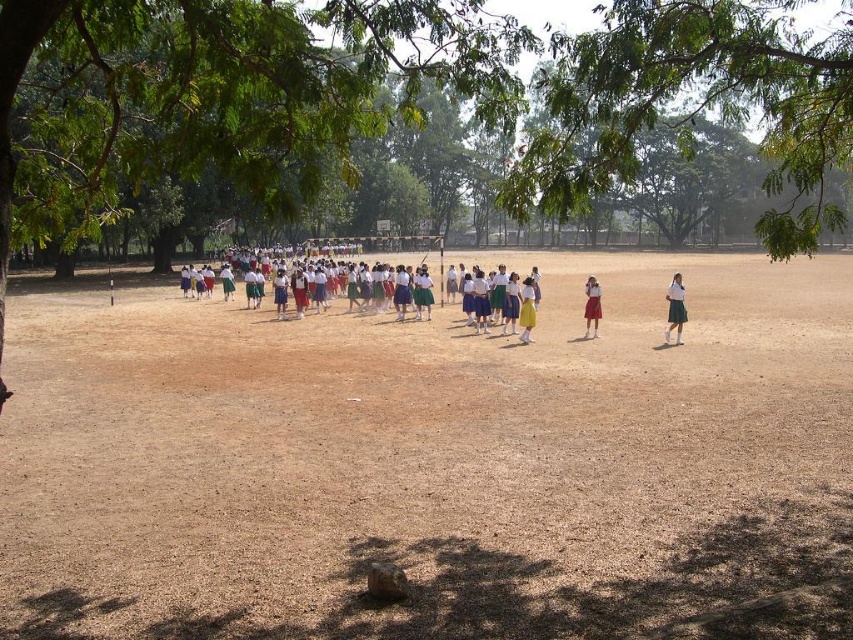
From the picture: Who is higher up, matte white blouse at center or matte red skirt at center?

matte white blouse at center

Measure the distance between point (677, 280) and camera.

A distance of 20.59 meters exists between point (677, 280) and camera.

Find the location of `matte white blouse at center`. matte white blouse at center is located at coordinates (675, 308).

Does point (827, 97) lie in front of point (672, 316)?

Yes, point (827, 97) is closer to viewer.

Can you confirm if green leafy tree at upper center is positioned to the left of matte white blouse at center?

In fact, green leafy tree at upper center is to the right of matte white blouse at center.

Find the location of a particular element. This screenshot has height=640, width=853. green leafy tree at upper center is located at coordinates (695, 104).

Is green leafy tree at center positioned at the back of matte white blouse at center?

No, it is in front of matte white blouse at center.

Can you confirm if green leafy tree at center is thinner than matte white blouse at center?

No.

Does point (357, 84) come farther from viewer compared to point (683, 304)?

No.

What are the coordinates of `green leafy tree at center` in the screenshot? It's located at (213, 90).